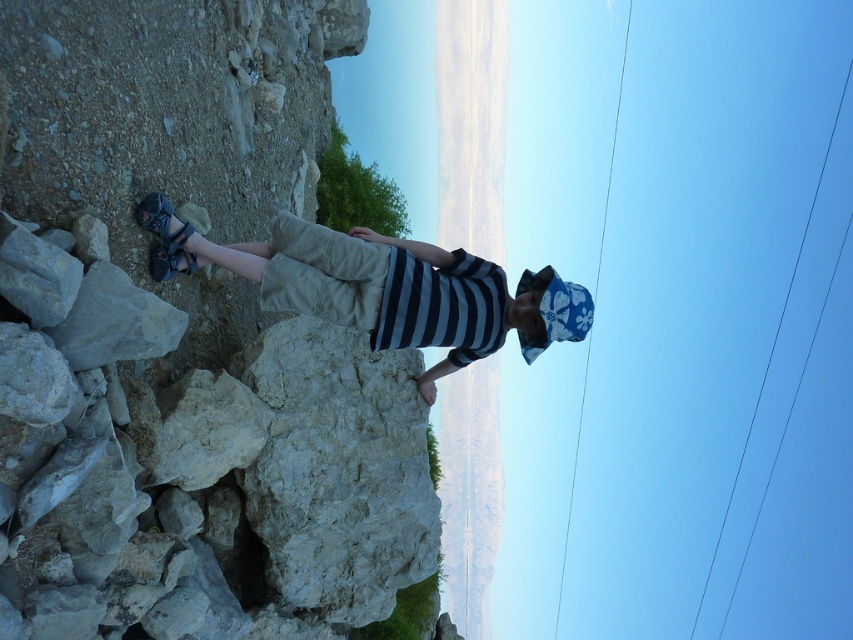
Between rough stone cliff at left and khaki cotton shorts at center, which one appears on the right side from the viewer's perspective?

Positioned to the right is khaki cotton shorts at center.

Is point (349, 49) farther from camera compared to point (379, 310)?

Yes, it is.

Who is more forward, (x=184, y=54) or (x=403, y=294)?

Point (x=403, y=294) is in front.

Where is `rough stone cliff at left`? This screenshot has width=853, height=640. rough stone cliff at left is located at coordinates (171, 131).